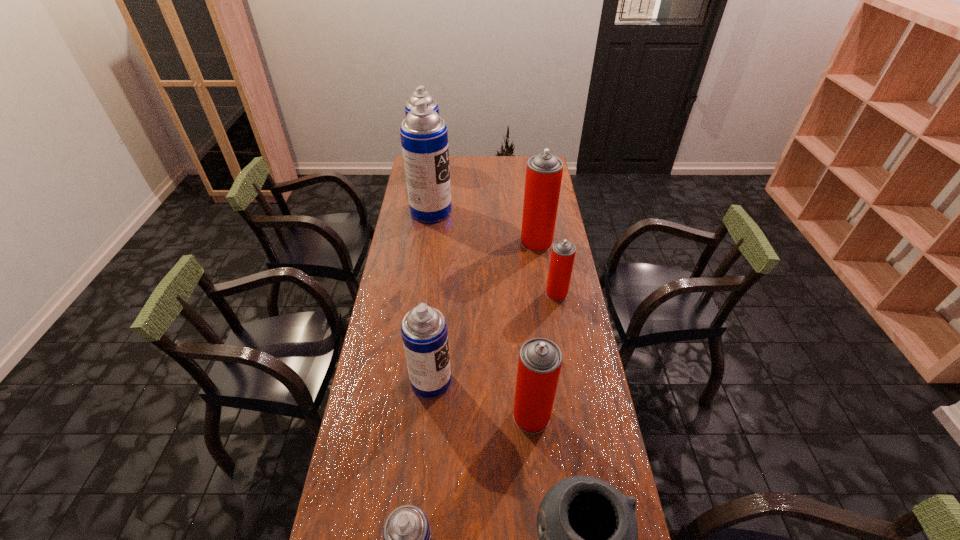
Locate an element on the screen. This screenshot has width=960, height=540. aerosol can that stands as the sixth closest to the smallest blue aerosol can is located at coordinates (420, 93).

The width and height of the screenshot is (960, 540). What are the coordinates of `aerosol can that is the sixth closest one to the fourth nearest object` in the screenshot? It's located at coord(420,93).

I want to click on the third closest blue aerosol can to the third nearest aerosol can, so click(420, 93).

Select which blue aerosol can appears as the third closest to the third farthest aerosol can. Please provide its 2D coordinates. Your answer should be formatted as a tuple, i.e. [(x, y)], where the tuple contains the x and y coordinates of a point satisfying the conditions above.

[(424, 332)]

Where is `the third closest red aerosol can to the black urn`? This screenshot has width=960, height=540. the third closest red aerosol can to the black urn is located at coordinates (544, 171).

Find the location of a particular element. This screenshot has height=540, width=960. red aerosol can that stands as the closest to the third farthest aerosol can is located at coordinates (563, 252).

The height and width of the screenshot is (540, 960). I want to click on vacant space that satisfies the following two spatial constraints: 1. on the label side of the second nearest red aerosol can; 2. on the left side of the third nearest blue aerosol can, so click(420, 294).

This screenshot has width=960, height=540. In order to click on vacant point that satisfies the following two spatial constraints: 1. on the back side of the biggest red aerosol can; 2. on the right side of the second biggest red aerosol can in this screenshot , I will do `click(516, 242)`.

Where is `free space that satisfies the following two spatial constraints: 1. on the label side of the third farthest blue aerosol can; 2. on the left side of the third nearest object`? The height and width of the screenshot is (540, 960). free space that satisfies the following two spatial constraints: 1. on the label side of the third farthest blue aerosol can; 2. on the left side of the third nearest object is located at coordinates (428, 416).